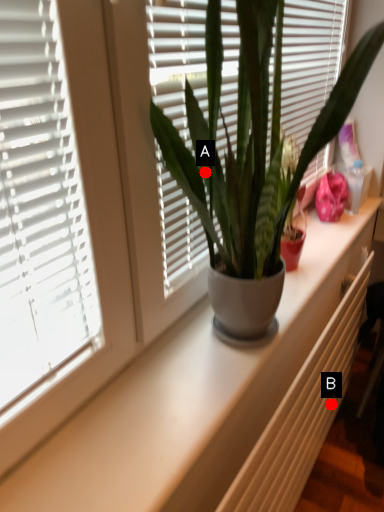
Question: Two points are circled on the image, labeled by A and B beside each circle. Among these points, which one is nearest to the camera?

Choices:
 (A) A is closer
 (B) B is closer

Answer: (A)